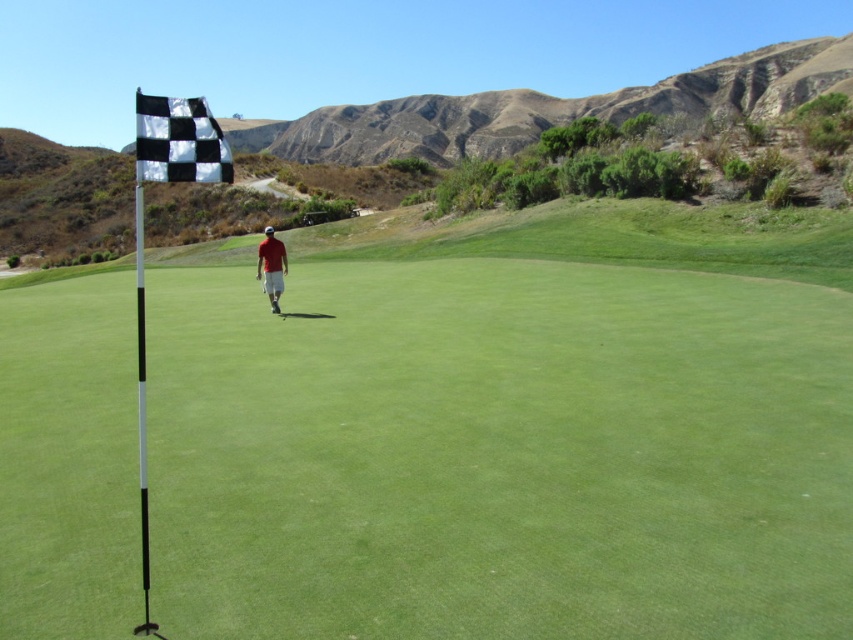
Question: Which point is closer to the camera?

Choices:
 (A) white plastic flag at left
 (B) black checkered flag at upper left

Answer: (B)

Question: Does white plastic flag at left come in front of red matte shirt at center?

Choices:
 (A) no
 (B) yes

Answer: (B)

Question: Which of the following is the farthest from the observer?

Choices:
 (A) (279, 243)
 (B) (329, 596)
 (C) (155, 113)

Answer: (A)

Question: Can you confirm if white plastic flag at left is thinner than red matte shirt at center?

Choices:
 (A) no
 (B) yes

Answer: (A)

Question: Which object is the closest to the red matte shirt at center?

Choices:
 (A) black checkered flag at upper left
 (B) white plastic flag at left

Answer: (B)

Question: Does white plastic flag at left appear on the right side of black checkered flag at upper left?

Choices:
 (A) no
 (B) yes

Answer: (B)